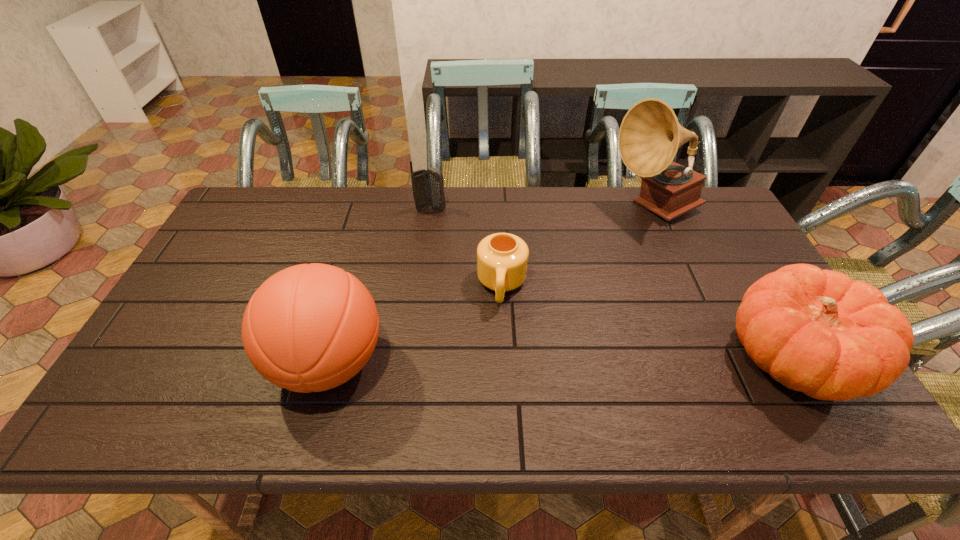
Image resolution: width=960 pixels, height=540 pixels. What are the coordinates of `free spot on the desktop that is between the second tallest object and the pumpkin and is positioned on the handle side of the shortest object` in the screenshot? It's located at (495, 361).

Locate an element on the screen. The width and height of the screenshot is (960, 540). free space on the desktop that is between the fourth shortest object and the pumpkin and is positioned on the keyboard of the cellular telephone is located at coordinates (565, 361).

Locate an element on the screen. This screenshot has width=960, height=540. vacant spot on the desktop that is between the second tallest object and the pumpkin and is positioned on the horn of the phonograph record is located at coordinates (566, 361).